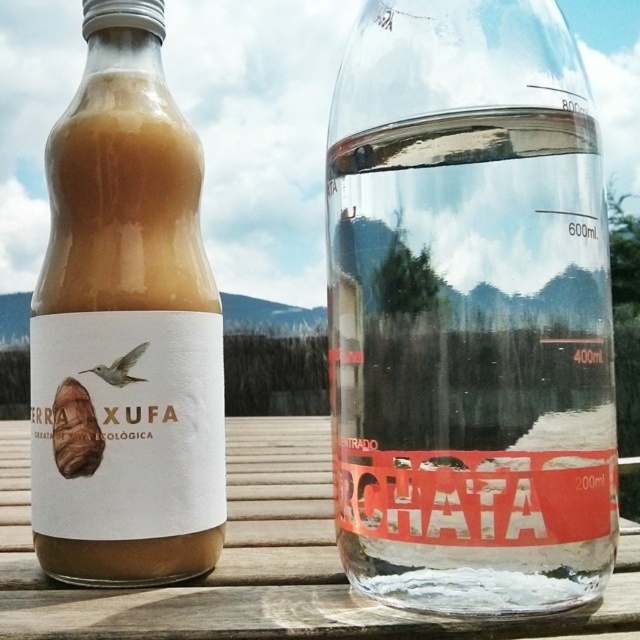
Is matte glass bottle at left above transparent wood table at center?

Yes.

Does matte glass bottle at left have a smaller size compared to transparent wood table at center?

Indeed, matte glass bottle at left has a smaller size compared to transparent wood table at center.

Describe the element at coordinates (125, 326) in the screenshot. I see `matte glass bottle at left` at that location.

Locate an element on the screen. This screenshot has width=640, height=640. matte glass bottle at left is located at coordinates [x=125, y=326].

Who is positioned more to the left, transparent glass bottle at center or transparent wood table at center?

Positioned to the left is transparent wood table at center.

Does transparent glass bottle at center have a greater width compared to transparent wood table at center?

No.

The width and height of the screenshot is (640, 640). What do you see at coordinates (468, 310) in the screenshot?
I see `transparent glass bottle at center` at bounding box center [468, 310].

You are a GUI agent. You are given a task and a screenshot of the screen. Output one action in this format:
    pyautogui.click(x=<x>, y=<y>)
    Task: Click on the transparent glass bottle at center
    
    Given the screenshot: What is the action you would take?
    pyautogui.click(x=468, y=310)

Is point (496, 426) closer to camera compared to point (157, 488)?

Yes.

Who is more forward, [413,580] or [216,525]?

Point [413,580] is in front.

Where is `transparent glass bottle at center`? The height and width of the screenshot is (640, 640). transparent glass bottle at center is located at coordinates (468, 310).